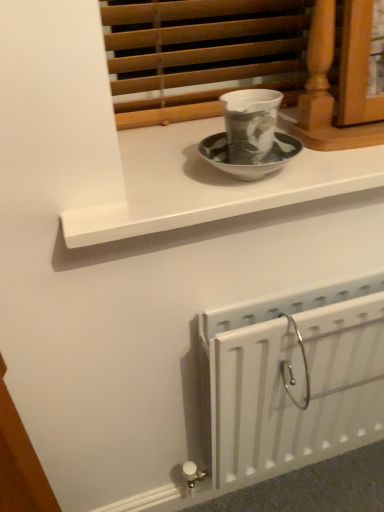
Question: Can you confirm if white matte radiator at lower right is shorter than white glossy window sill at upper center?

Choices:
 (A) no
 (B) yes

Answer: (A)

Question: Can you confirm if white matte radiator at lower right is bigger than white glossy window sill at upper center?

Choices:
 (A) yes
 (B) no

Answer: (A)

Question: Is white matte radiator at lower right positioned far away from white glossy window sill at upper center?

Choices:
 (A) no
 (B) yes

Answer: (A)

Question: From the image's perspective, is white matte radiator at lower right on white glossy window sill at upper center?

Choices:
 (A) yes
 (B) no

Answer: (B)

Question: Is white matte radiator at lower right facing towards white glossy window sill at upper center?

Choices:
 (A) no
 (B) yes

Answer: (A)

Question: From a real-world perspective, is white matte radiator at lower right physically above white glossy window sill at upper center?

Choices:
 (A) yes
 (B) no

Answer: (B)

Question: Considering the relative positions of white glossy window sill at upper center and white matte radiator at lower right in the image provided, is white glossy window sill at upper center in front of white matte radiator at lower right?

Choices:
 (A) no
 (B) yes

Answer: (B)

Question: Can you confirm if white glossy window sill at upper center is shorter than white matte radiator at lower right?

Choices:
 (A) yes
 (B) no

Answer: (A)

Question: Is white glossy window sill at upper center facing away from white matte radiator at lower right?

Choices:
 (A) no
 (B) yes

Answer: (A)

Question: Does white glossy window sill at upper center have a greater height compared to white matte radiator at lower right?

Choices:
 (A) yes
 (B) no

Answer: (B)

Question: Considering the relative sizes of white glossy window sill at upper center and white matte radiator at lower right in the image provided, is white glossy window sill at upper center thinner than white matte radiator at lower right?

Choices:
 (A) yes
 (B) no

Answer: (B)

Question: Is white glossy window sill at upper center at the left side of white matte radiator at lower right?

Choices:
 (A) no
 (B) yes

Answer: (B)

Question: Looking at the image, does white glossy window sill at upper center seem bigger or smaller compared to white matte radiator at lower right?

Choices:
 (A) big
 (B) small

Answer: (B)